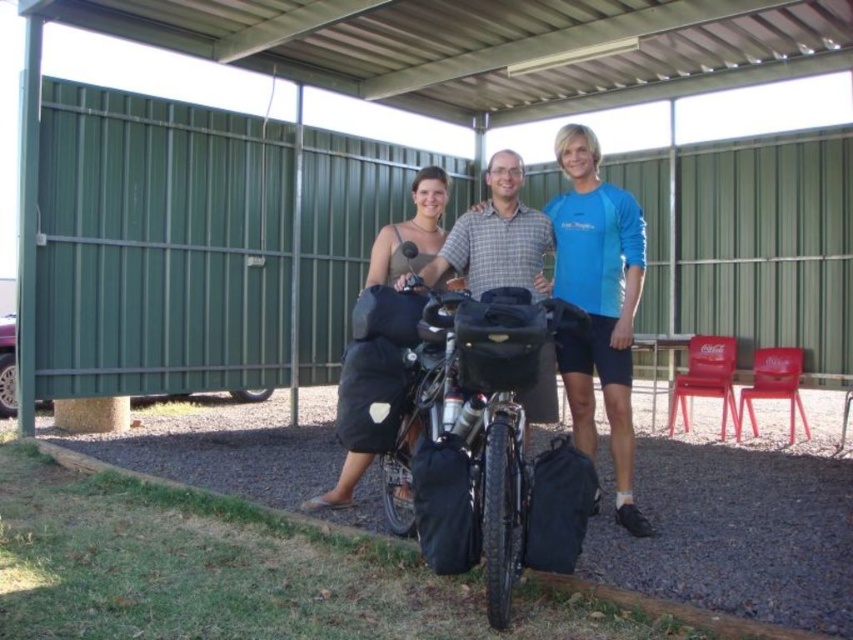
You are standing at the camera position and want to pick up an object located at point (555, 209). Can you reach it without moving your feet?

The point (555, 209) is 4.32 meters away from the camera position. Since the average person can only reach about 1.5 meters without moving their feet, you cannot reach it without moving.

You are taking a photo of the scene and want to focus on both point at (x=622, y=428) and point at (x=422, y=388). Which point should you adjust your focus to first if you want to ensure both are in sharp focus?

You should focus on point at (x=622, y=428) first because it is closer to the camera than point at (x=422, y=388). By focusing on the closer point, the farther point will also be within the depth of field and in focus.